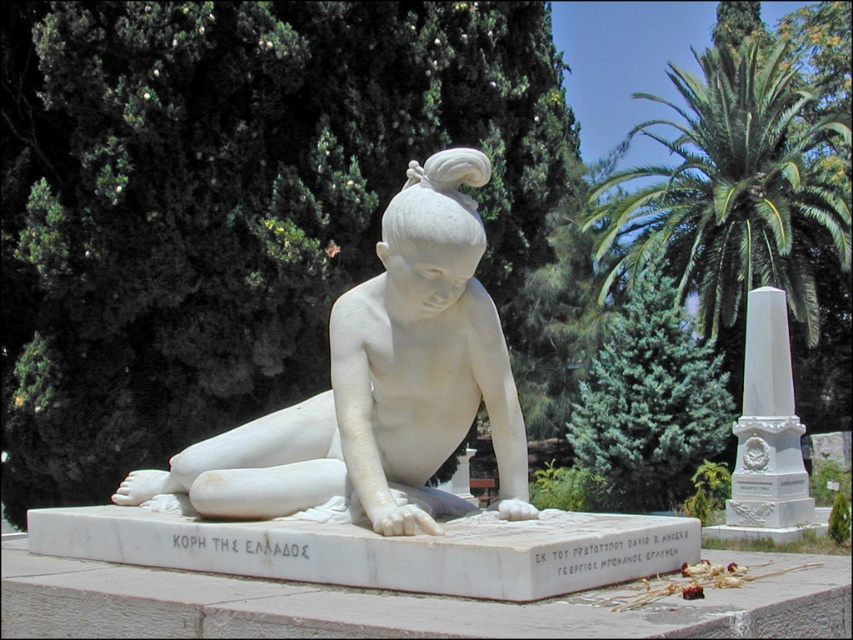
Question: Which point is farther to the camera?

Choices:
 (A) (804, 476)
 (B) (378, 493)

Answer: (A)

Question: Which point is closer to the camera?

Choices:
 (A) (762, 406)
 (B) (734, 323)
 (C) (350, 344)

Answer: (C)

Question: Does white marble statue at center have a larger size compared to green leafy palm at upper right?

Choices:
 (A) no
 (B) yes

Answer: (A)

Question: Does green leafy palm at upper right have a larger size compared to white marble obelisk at right?

Choices:
 (A) no
 (B) yes

Answer: (B)

Question: Does white marble statue at center have a larger size compared to white marble obelisk at right?

Choices:
 (A) no
 (B) yes

Answer: (A)

Question: Which object appears closest to the camera in this image?

Choices:
 (A) white marble obelisk at right
 (B) white marble statue at center

Answer: (B)